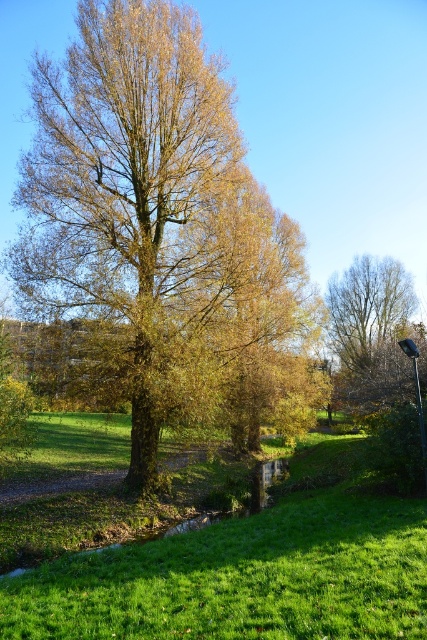
Question: Does green grass at center lie in front of metallic gray lamp post at lower right?

Choices:
 (A) no
 (B) yes

Answer: (B)

Question: Among these points, which one is farthest from the camera?

Choices:
 (A) (218, 97)
 (B) (424, 445)

Answer: (A)

Question: Is green grass at center wider than metallic gray lamp post at lower right?

Choices:
 (A) yes
 (B) no

Answer: (A)

Question: Is green grass at center positioned at the back of metallic gray lamp post at lower right?

Choices:
 (A) no
 (B) yes

Answer: (A)

Question: Which point appears closest to the camera in this image?

Choices:
 (A) (280, 506)
 (B) (424, 460)
 (C) (143, 372)

Answer: (B)

Question: Which point is closer to the camera?

Choices:
 (A) (178, 198)
 (B) (414, 348)
 (C) (322, 561)

Answer: (C)